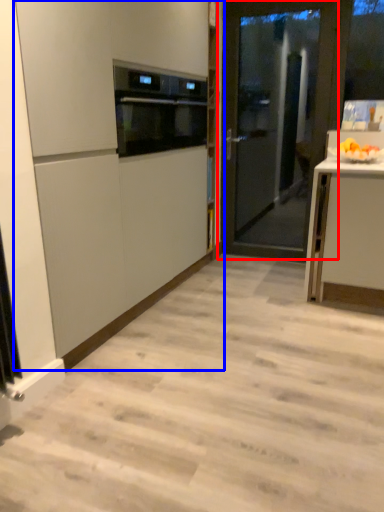
Question: Which point is closer to the camera, door (highlighted by a red box) or cabinetry (highlighted by a blue box)?

Choices:
 (A) door
 (B) cabinetry

Answer: (B)